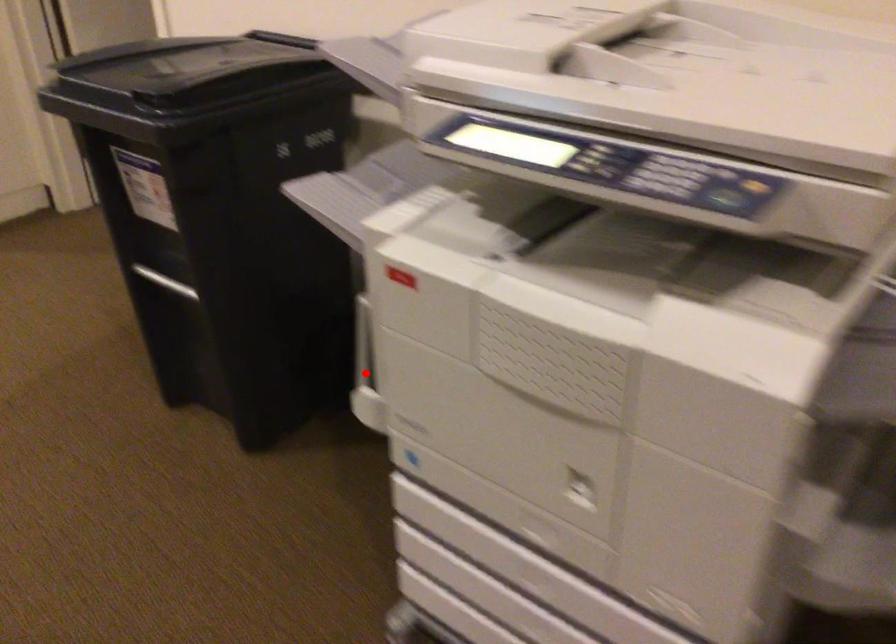
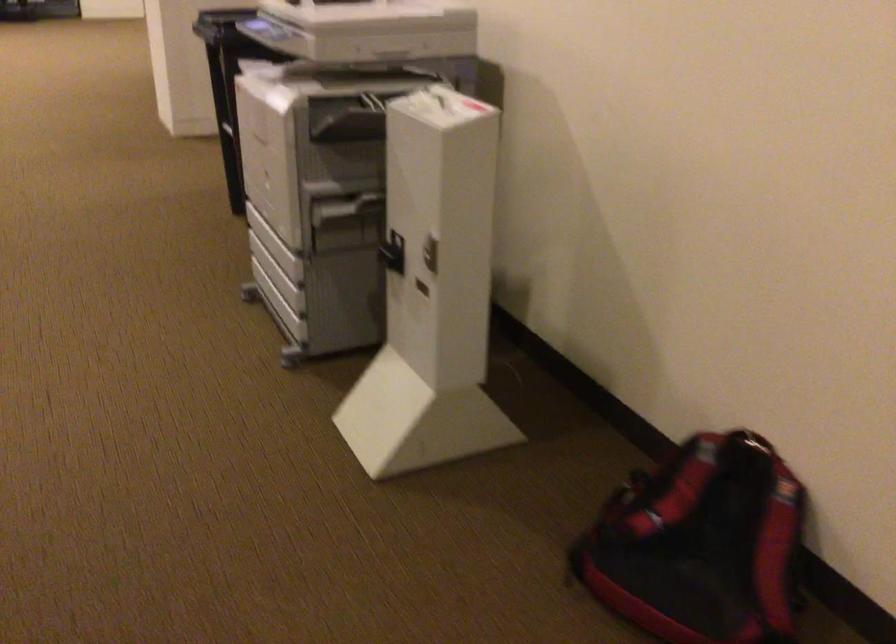
Question: I am providing you with two images of the same scene from different viewpoints. A red point is marked on the first image. At the location where the point appears in image 1, is it still visible in image 2?

Choices:
 (A) Yes
 (B) No

Answer: (B)